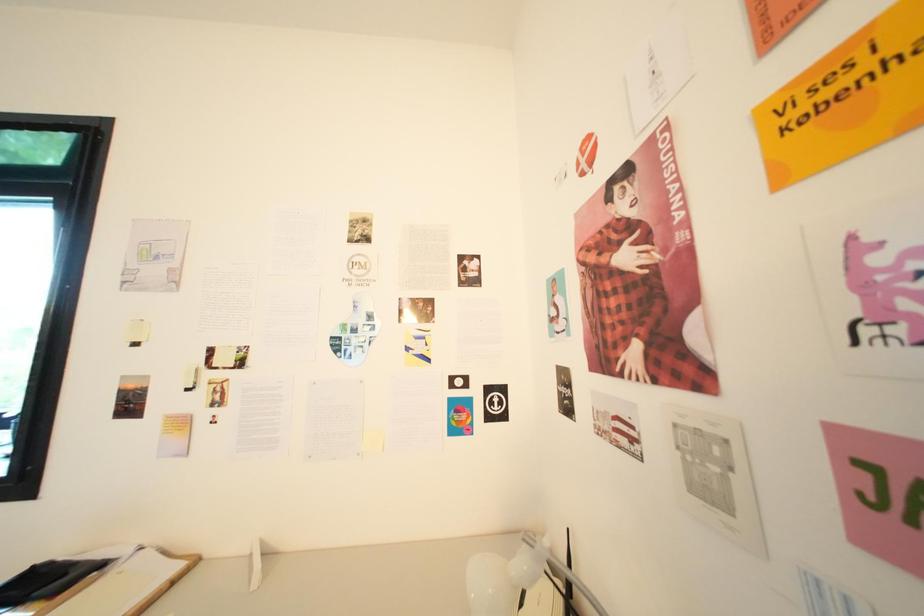
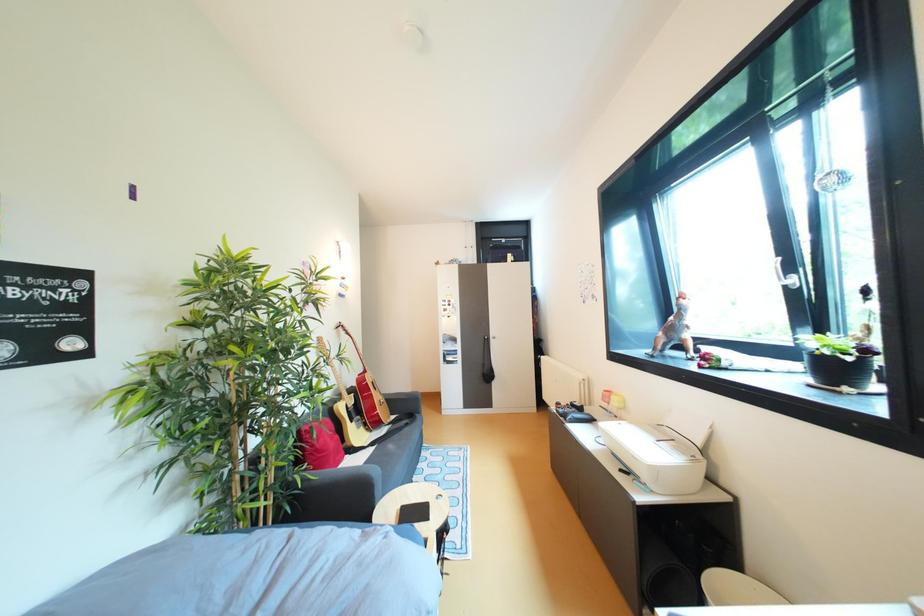
Question: How did the camera likely rotate?

Choices:
 (A) Left
 (B) Right
 (C) Up
 (D) Down

Answer: (A)